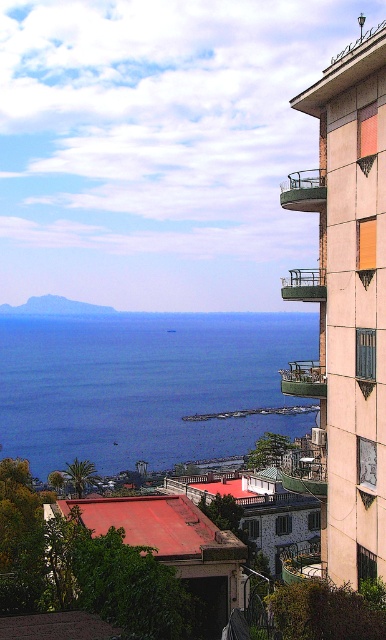
You are standing at the top of the cliff overlooking the coastal area. You see a point marked at coordinates point (69, 417). If you want to throw a pebble to hit this point, considering the distance, would you need to throw it with a strong force or a gentle toss?

The point (69, 417) is 870.02 feet away from the viewer. To cover such a long distance, you would need to throw the pebble with a strong force.

You are a photographer planning to capture the entire scene in one shot. Given that your camera can only focus on objects within a 100cm width, can you confirm if both the blue water at lower left and the green metal balcony at upper right will fit within the camera frame?

The blue water at lower left might be wider than green metal balcony at upper right, so it is uncertain if both will fit within the camera frame. Check the actual width of both objects to ensure they fit within the 100cm limit.

You are standing at the edge of the cliff overlooking the coastal view. You want to throw a small stone into the blue water at lower left. Considering the distance, do you think you can reach it with your throw?

The blue water at lower left is 209.13 meters away from the viewer. The average human throwing distance is around 20 to 30 meters, so it is unlikely you can reach it with a single throw.